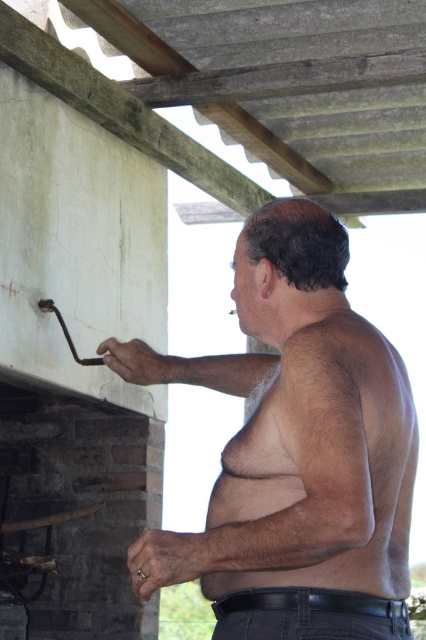
Question: Does shiny metallic tool at upper left lie behind hairy skin at upper right?

Choices:
 (A) yes
 (B) no

Answer: (A)

Question: Which point is farther to the camera?

Choices:
 (A) (299, 492)
 (B) (321, 372)

Answer: (A)

Question: Can you confirm if shiny metallic tool at upper left is positioned above hairy skin at upper right?

Choices:
 (A) yes
 (B) no

Answer: (A)

Question: Can you confirm if shiny metallic tool at upper left is bigger than hairy skin at upper right?

Choices:
 (A) no
 (B) yes

Answer: (B)

Question: Which point is farther to the camera?

Choices:
 (A) shiny metallic tool at upper left
 (B) hairy skin at upper right

Answer: (A)